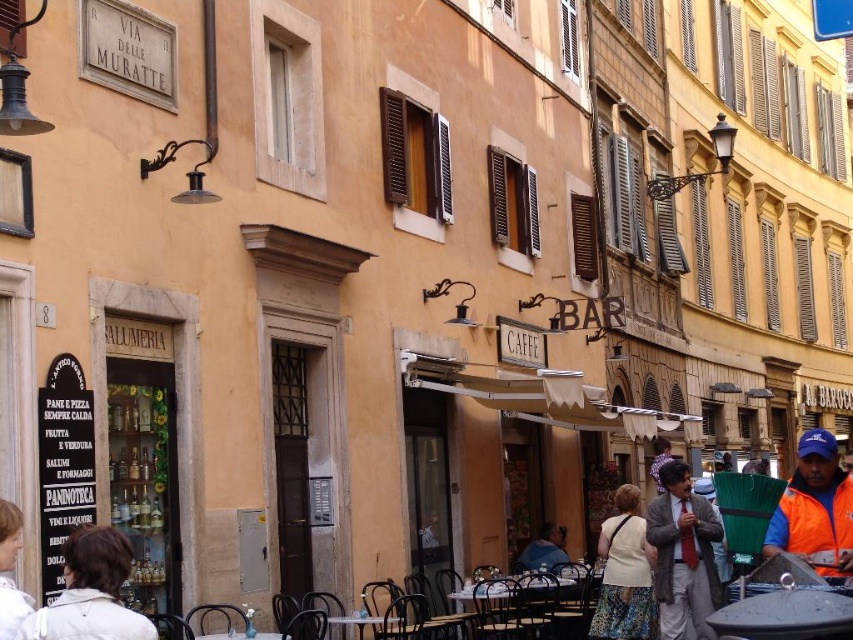
Which is more to the right, white fabric jacket at lower left or white fabric shirt at lower left?

white fabric jacket at lower left

Does point (74, 540) come closer to viewer compared to point (0, 593)?

No, it is not.

Where is `white fabric jacket at lower left`? white fabric jacket at lower left is located at coordinates (91, 593).

Does point (109, 593) lie in front of point (752, 627)?

Yes, it is.

Can you confirm if white fabric jacket at lower left is positioned to the left of white glossy table at lower right?

Correct, you'll find white fabric jacket at lower left to the left of white glossy table at lower right.

Is point (96, 531) more distant than point (724, 628)?

No.

The height and width of the screenshot is (640, 853). I want to click on white fabric jacket at lower left, so click(91, 593).

Is point (3, 566) closer to camera compared to point (546, 554)?

Yes, it is in front of point (546, 554).

Does white fabric shirt at lower left have a lesser height compared to blue denim jacket at lower center?

No.

Which is behind, point (10, 522) or point (549, 529)?

The point (549, 529) is behind.

Locate an element on the screen. This screenshot has height=640, width=853. white fabric shirt at lower left is located at coordinates (10, 570).